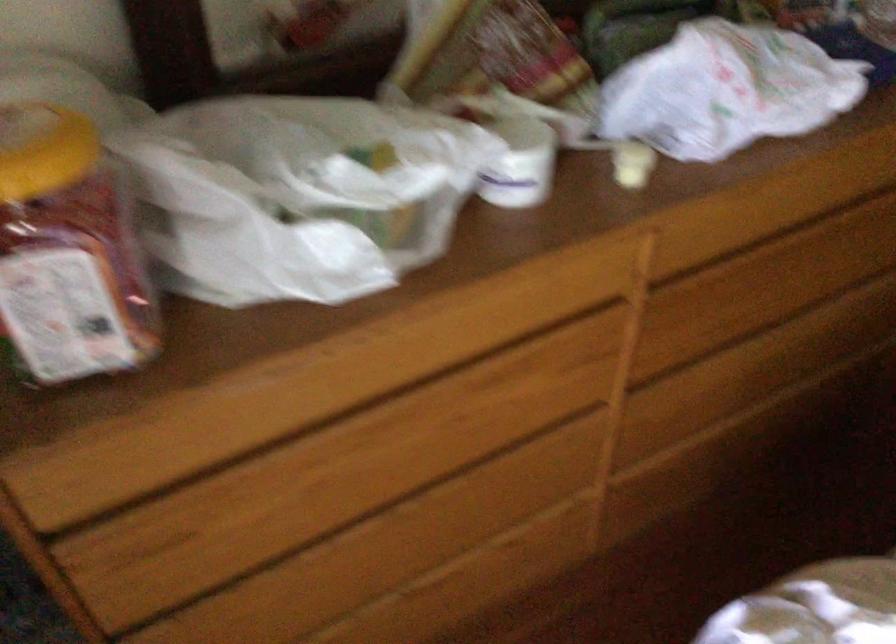
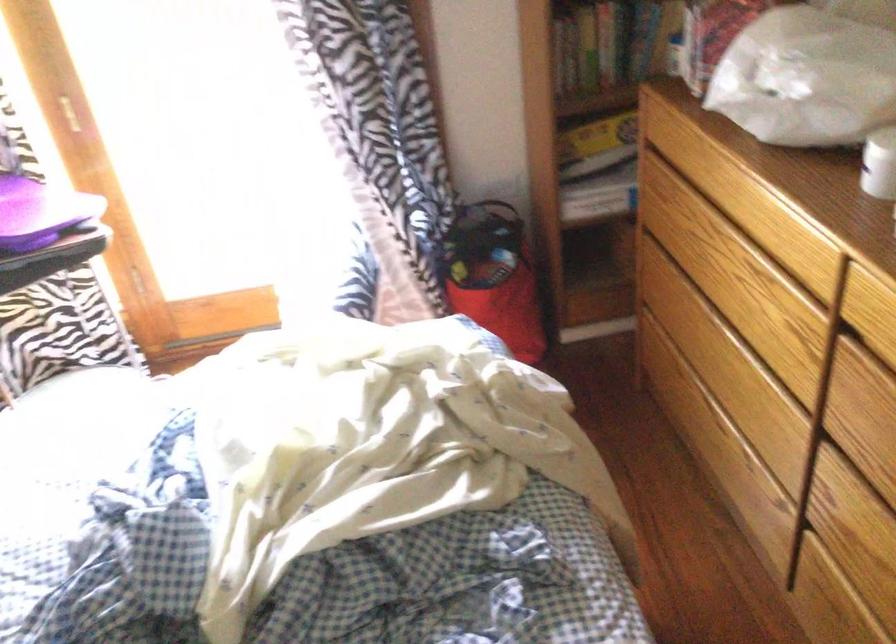
In the second image, find the point that corresponds to point (544, 169) in the first image.

(879, 164)